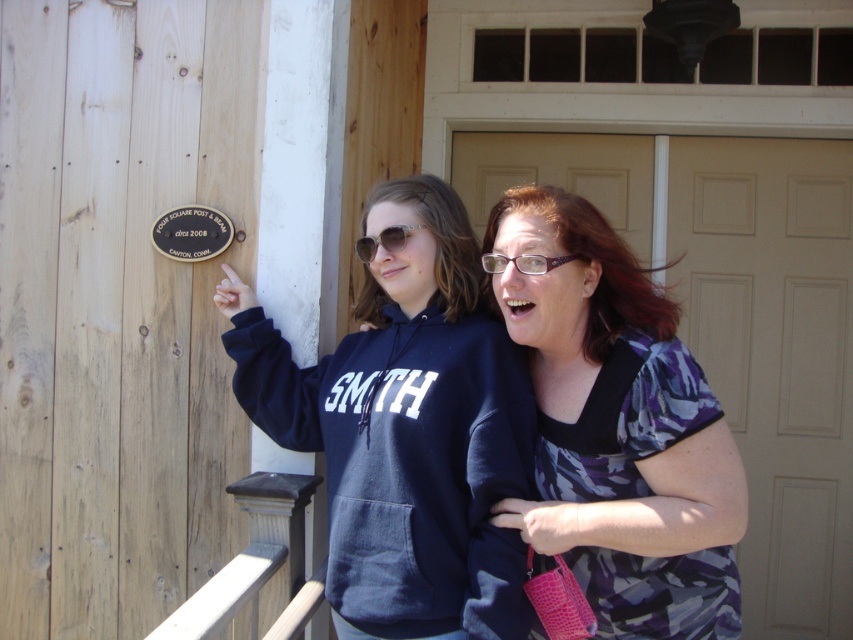
Question: Among these objects, which one is nearest to the camera?

Choices:
 (A) camouflage fabric blouse at center
 (B) navy blue hoodie at center

Answer: (A)

Question: Where is wooden at lower left located in relation to sunglasses at center in the image?

Choices:
 (A) above
 (B) below

Answer: (B)

Question: Can you confirm if white matte door at center is thinner than sunglasses at center?

Choices:
 (A) yes
 (B) no

Answer: (B)

Question: Among these objects, which one is nearest to the camera?

Choices:
 (A) camouflage fabric blouse at center
 (B) sunglasses at center
 (C) clear plastic glasses at upper center
 (D) white matte door at center

Answer: (A)

Question: Does wooden at lower left have a greater width compared to sunglasses at center?

Choices:
 (A) no
 (B) yes

Answer: (B)

Question: Based on their relative distances, which object is nearer to the clear plastic glasses at upper center?

Choices:
 (A) navy blue hoodie at center
 (B) sunglasses at center
 (C) wooden at lower left

Answer: (B)